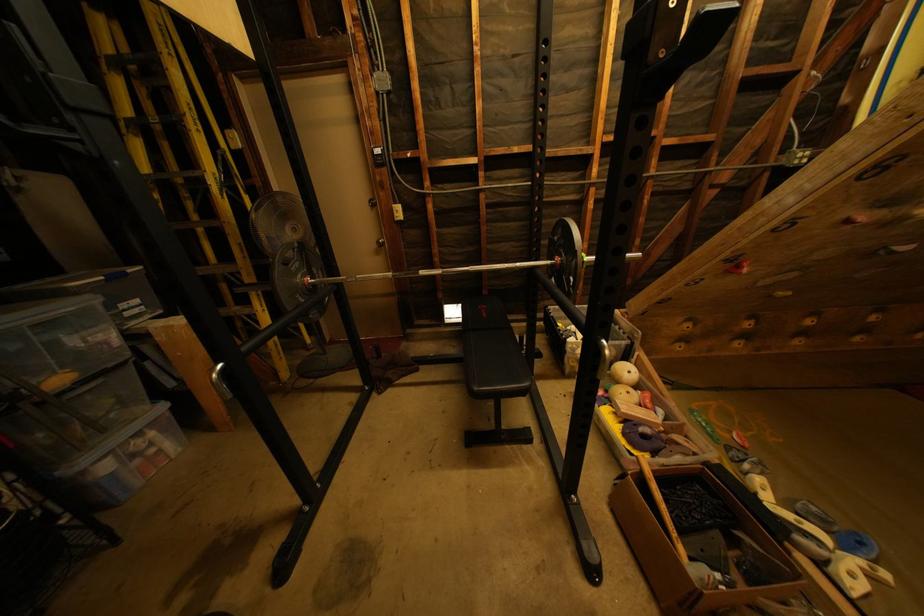
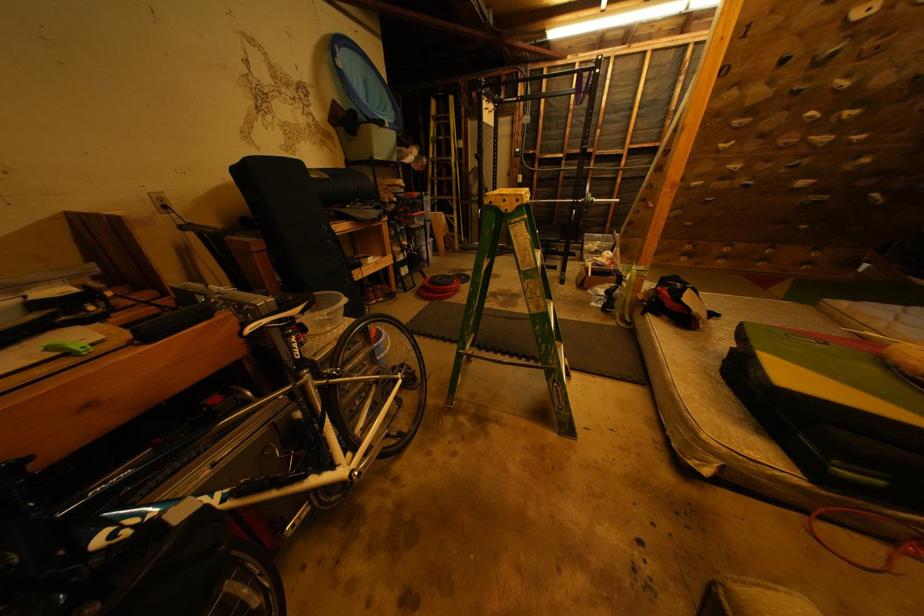
Question: In a continuous first-person perspective shot, in which direction is the camera moving?

Choices:
 (A) Left
 (B) Right
 (C) Forward
 (D) Backward

Answer: (D)